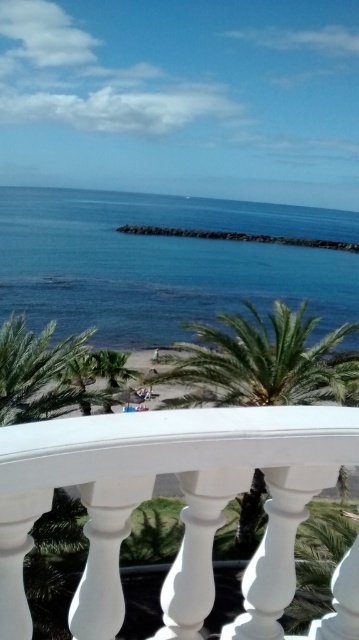
Question: Which point is closer to the camera?

Choices:
 (A) white glossy balustrade at lower center
 (B) blue water at center
 (C) green leafy palm tree at center

Answer: (A)

Question: Which of the following is the farthest from the observer?

Choices:
 (A) blue water at center
 (B) white glossy balustrade at lower center
 (C) green leafy palm tree at center

Answer: (A)

Question: Which of the following is the closest to the observer?

Choices:
 (A) blue water at center
 (B) white glossy balustrade at lower center
 (C) green leafy palm tree at center

Answer: (B)

Question: Does blue water at center appear on the right side of green leafy palm tree at center?

Choices:
 (A) yes
 (B) no

Answer: (B)

Question: Is white glossy balustrade at lower center thinner than green leafy palm tree at center?

Choices:
 (A) no
 (B) yes

Answer: (B)

Question: Does blue water at center have a lesser width compared to green leafy palm tree at center?

Choices:
 (A) no
 (B) yes

Answer: (A)